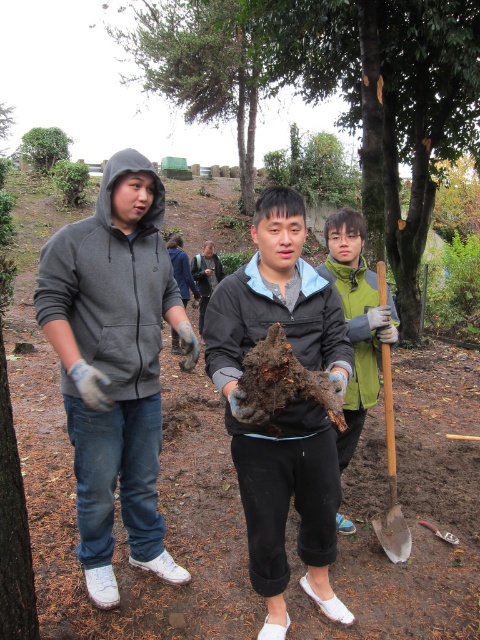
Which of these two, rough bark tree at center or green matte sweatshirt at center, stands taller?

rough bark tree at center

Who is lower down, rough bark tree at center or green matte sweatshirt at center?

green matte sweatshirt at center is lower down.

Is point (184, 81) positioned behind point (335, 262)?

Yes, point (184, 81) is farther from viewer.

Where is `rough bark tree at center`? rough bark tree at center is located at coordinates (335, 90).

Can you confirm if matte gray hoodie at left is thinner than matte black sweatshirt at center?

Incorrect, matte gray hoodie at left's width is not less than matte black sweatshirt at center's.

From the picture: Is matte gray hoodie at left below matte black sweatshirt at center?

No, matte gray hoodie at left is not below matte black sweatshirt at center.

At what (x,y) coordinates should I click in order to perform the action: click on matte gray hoodie at left. Please return your answer as a coordinate pair (x, y). The height and width of the screenshot is (640, 480). Looking at the image, I should click on (106, 282).

How distant is matte gray hoodie at left from wooden shovel at lower right?

matte gray hoodie at left and wooden shovel at lower right are 4.55 feet apart from each other.

Does matte gray hoodie at left appear on the left side of wooden shovel at lower right?

Correct, you'll find matte gray hoodie at left to the left of wooden shovel at lower right.

This screenshot has width=480, height=640. In order to click on matte gray hoodie at left in this screenshot , I will do `click(106, 282)`.

Where is `matte gray hoodie at left`? The height and width of the screenshot is (640, 480). matte gray hoodie at left is located at coordinates (106, 282).